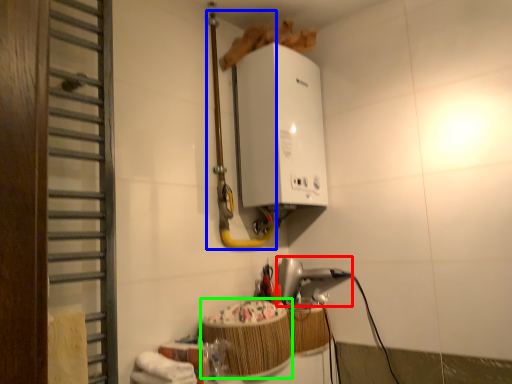
Question: Based on their relative distances, which object is farther from appliance (highlighted by a red box)? Choose from pipe (highlighted by a blue box) and basket (highlighted by a green box).

Choices:
 (A) pipe
 (B) basket

Answer: (A)